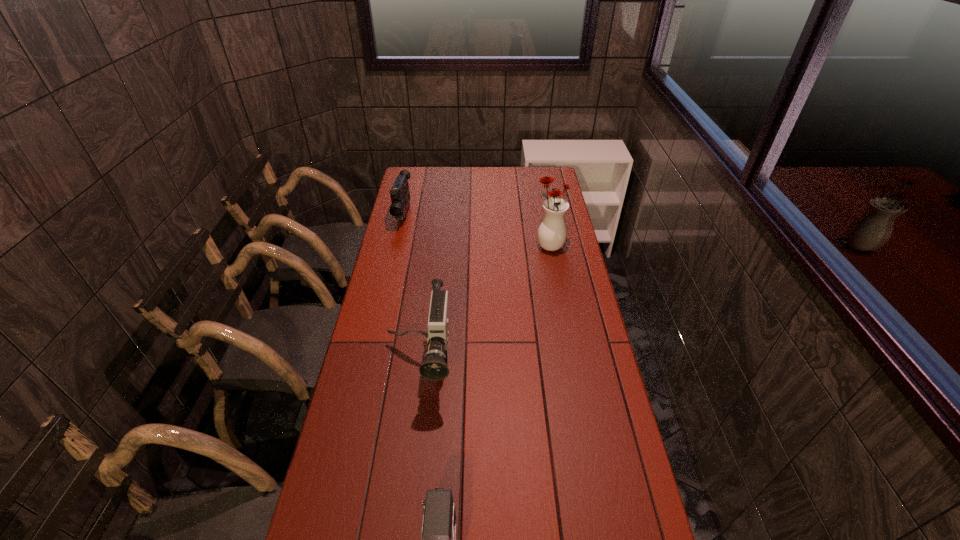
Where is `vacant space at the far edge of the desktop`? Image resolution: width=960 pixels, height=540 pixels. vacant space at the far edge of the desktop is located at coordinates (504, 184).

Image resolution: width=960 pixels, height=540 pixels. I want to click on vacant space at the left edge of the desktop, so click(410, 239).

The height and width of the screenshot is (540, 960). In order to click on free spot at the right edge of the desktop in this screenshot , I will do `click(571, 427)`.

Where is `vacant space at the far right corner of the desktop`? The height and width of the screenshot is (540, 960). vacant space at the far right corner of the desktop is located at coordinates (554, 173).

At what (x,y) coordinates should I click in order to perform the action: click on vacant space that is in between the rightmost object and the second tallest object. Please return your answer as a coordinate pair (x, y). The height and width of the screenshot is (540, 960). Looking at the image, I should click on (485, 305).

Where is `vacant area that lies between the farthest object and the second tallest object`? This screenshot has width=960, height=540. vacant area that lies between the farthest object and the second tallest object is located at coordinates (412, 289).

This screenshot has width=960, height=540. Identify the location of free spot between the rightmost object and the leftmost object. (476, 231).

The width and height of the screenshot is (960, 540). I want to click on free space that is in between the leftmost camcorder and the second tallest object, so click(412, 289).

The width and height of the screenshot is (960, 540). I want to click on free space that is in between the leftmost camcorder and the second farthest object, so click(476, 231).

Find the location of `free space that is in between the second farthest camcorder and the tallest object`. free space that is in between the second farthest camcorder and the tallest object is located at coordinates (485, 305).